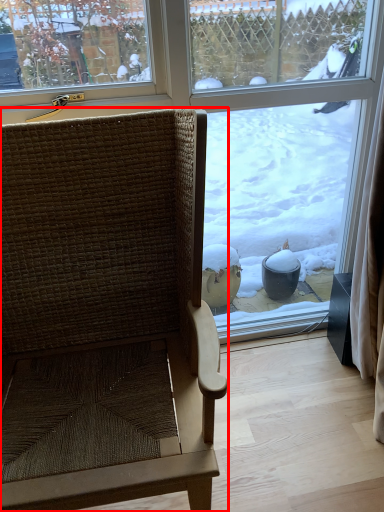
Question: Observing the image, what is the correct spatial positioning of chair (annotated by the red box) in reference to window?

Choices:
 (A) left
 (B) right

Answer: (A)